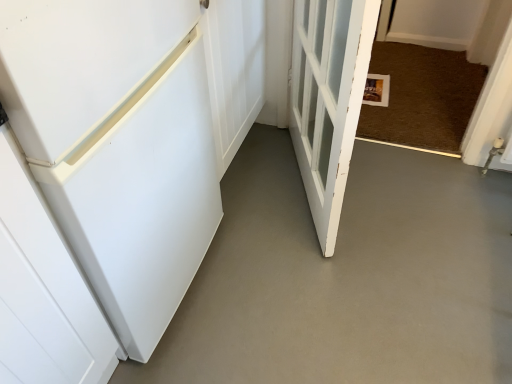
Question: Should I look upward or downward to see white wooden door at center, which appears as the first door when viewed from the right?

Choices:
 (A) down
 (B) up

Answer: (B)

Question: Is white wooden door at center, which appears as the first door when viewed from the right, shorter than white smooth concrete at lower left?

Choices:
 (A) no
 (B) yes

Answer: (A)

Question: Is white wooden door at center, the second door from the left, at the left side of white smooth concrete at lower left?

Choices:
 (A) no
 (B) yes

Answer: (B)

Question: Does white wooden door at center, the second door from the left, come in front of white smooth concrete at lower left?

Choices:
 (A) yes
 (B) no

Answer: (A)

Question: Can you see white wooden door at center, which appears as the first door when viewed from the right, touching white smooth concrete at lower left?

Choices:
 (A) no
 (B) yes

Answer: (A)

Question: Can you confirm if white wooden door at center, which appears as the first door when viewed from the right, is bigger than white smooth concrete at lower left?

Choices:
 (A) yes
 (B) no

Answer: (A)

Question: Does white wooden door at center, the second door from the left, contain white smooth concrete at lower left?

Choices:
 (A) yes
 (B) no

Answer: (B)

Question: Is white smooth concrete at lower left with white matte refrigerator at left, the 2th door viewed from the right?

Choices:
 (A) yes
 (B) no

Answer: (B)

Question: Considering the relative sizes of white smooth concrete at lower left and white matte refrigerator at left, the 2th door viewed from the right, in the image provided, is white smooth concrete at lower left smaller than white matte refrigerator at left, the 2th door viewed from the right,?

Choices:
 (A) yes
 (B) no

Answer: (A)

Question: Does white smooth concrete at lower left lie behind white matte refrigerator at left, which ranks as the first door in left-to-right order?

Choices:
 (A) yes
 (B) no

Answer: (B)

Question: Is white smooth concrete at lower left taller than white matte refrigerator at left, the 2th door viewed from the right?

Choices:
 (A) no
 (B) yes

Answer: (A)

Question: Is white smooth concrete at lower left oriented away from white matte refrigerator at left, which ranks as the first door in left-to-right order?

Choices:
 (A) no
 (B) yes

Answer: (A)

Question: From the image's perspective, is white smooth concrete at lower left over white matte refrigerator at left, the 2th door viewed from the right?

Choices:
 (A) yes
 (B) no

Answer: (B)

Question: Is white wooden door at center, which appears as the first door when viewed from the right, facing away from white matte refrigerator at left, which ranks as the first door in left-to-right order?

Choices:
 (A) no
 (B) yes

Answer: (B)